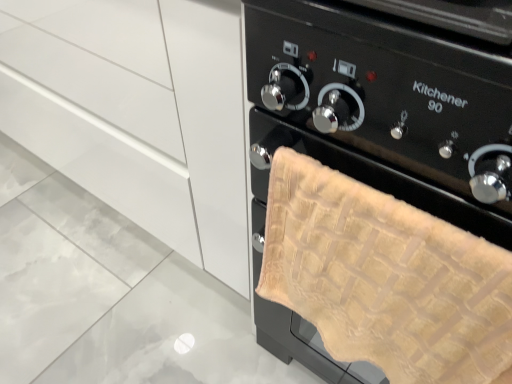
Question: From their relative heights in the image, would you say matte white cabinet at center is taller or shorter than beige textured towel at right?

Choices:
 (A) short
 (B) tall

Answer: (B)

Question: From a real-world perspective, relative to beige textured towel at right, is matte white cabinet at center vertically above or below?

Choices:
 (A) above
 (B) below

Answer: (B)

Question: Is matte white cabinet at center inside the boundaries of beige textured towel at right, or outside?

Choices:
 (A) inside
 (B) outside

Answer: (B)

Question: Is beige textured towel at right to the left or to the right of matte white cabinet at center in the image?

Choices:
 (A) right
 (B) left

Answer: (A)

Question: Looking at their shapes, would you say beige textured towel at right is wider or thinner than matte white cabinet at center?

Choices:
 (A) wide
 (B) thin

Answer: (B)

Question: From a real-world perspective, is beige textured towel at right positioned above or below matte white cabinet at center?

Choices:
 (A) above
 (B) below

Answer: (A)

Question: Considering the positions of beige textured towel at right and matte white cabinet at center in the image, is beige textured towel at right bigger or smaller than matte white cabinet at center?

Choices:
 (A) big
 (B) small

Answer: (B)